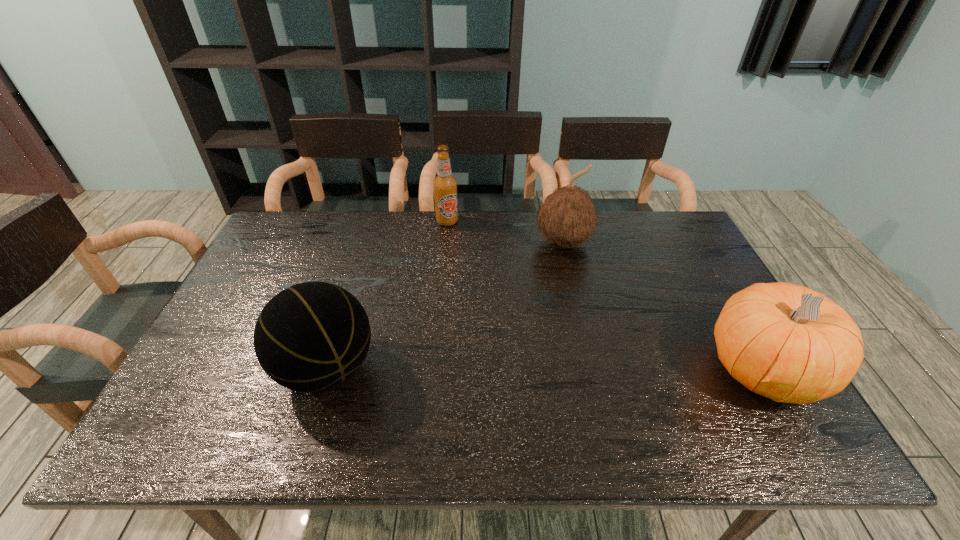
Where is `the leftmost object`? This screenshot has height=540, width=960. the leftmost object is located at coordinates (309, 338).

I want to click on the rightmost object, so click(x=786, y=342).

Find the location of a particular element. the second object from right to left is located at coordinates (567, 217).

Locate an element on the screen. This screenshot has width=960, height=540. the second object from left to right is located at coordinates 445,185.

I want to click on free space located on the right of the basketball, so click(x=464, y=369).

Where is `blank space located 0.260m on the surface of the coconut`? This screenshot has width=960, height=540. blank space located 0.260m on the surface of the coconut is located at coordinates (590, 322).

You are a GUI agent. You are given a task and a screenshot of the screen. Output one action in this format:
    pyautogui.click(x=<x>, y=<y>)
    Task: Click on the vacant space located 0.140m on the surface of the coconut
    
    Given the screenshot: What is the action you would take?
    pyautogui.click(x=580, y=292)

I want to click on free space located 0.320m on the surface of the coconut, so click(596, 340).

The width and height of the screenshot is (960, 540). What are the coordinates of `vacant space situated on the front label of the beer bottle` in the screenshot? It's located at (460, 259).

The image size is (960, 540). What are the coordinates of `vacant space situated on the front label of the beer bottle` in the screenshot? It's located at (467, 277).